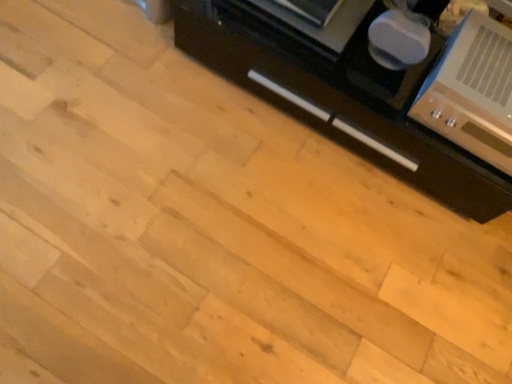
What do you see at coordinates (341, 95) in the screenshot? I see `black matte cabinet at right` at bounding box center [341, 95].

Find the location of a particular element. black matte cabinet at right is located at coordinates (341, 95).

What do you see at coordinates (472, 91) in the screenshot? This screenshot has width=512, height=384. I see `metallic silver stereo at upper right` at bounding box center [472, 91].

Where is `metallic silver stereo at upper right`? This screenshot has width=512, height=384. metallic silver stereo at upper right is located at coordinates (472, 91).

Measure the distance between point (490, 46) and camera.

1.23 meters.

Where is `black matte cabinet at right`? Image resolution: width=512 pixels, height=384 pixels. black matte cabinet at right is located at coordinates (341, 95).

In the scene shown: Is black matte cabinet at right at the right side of metallic silver stereo at upper right?

Incorrect, black matte cabinet at right is not on the right side of metallic silver stereo at upper right.

Considering the positions of objects black matte cabinet at right and metallic silver stereo at upper right in the image provided, who is in front, black matte cabinet at right or metallic silver stereo at upper right?

metallic silver stereo at upper right.

Which point is more forward, (314, 47) or (473, 95)?

Positioned in front is point (473, 95).

From the image's perspective, is black matte cabinet at right located above or below metallic silver stereo at upper right?

black matte cabinet at right is above metallic silver stereo at upper right.

From a real-world perspective, is black matte cabinet at right above or below metallic silver stereo at upper right?

From a real-world perspective, black matte cabinet at right is physically below metallic silver stereo at upper right.

Considering the sizes of black matte cabinet at right and metallic silver stereo at upper right in the image, is black matte cabinet at right wider or thinner than metallic silver stereo at upper right?

Clearly, black matte cabinet at right has more width compared to metallic silver stereo at upper right.

Can you confirm if black matte cabinet at right is taller than metallic silver stereo at upper right?

Indeed, black matte cabinet at right has a greater height compared to metallic silver stereo at upper right.

Which of these two, black matte cabinet at right or metallic silver stereo at upper right, is bigger?

black matte cabinet at right is bigger.

Is metallic silver stereo at upper right completely or partially inside black matte cabinet at right?

No, metallic silver stereo at upper right is not surrounded by black matte cabinet at right.

Is black matte cabinet at right beside metallic silver stereo at upper right?

They are not placed beside each other.

Is black matte cabinet at right oriented towards metallic silver stereo at upper right?

No, black matte cabinet at right is not oriented towards metallic silver stereo at upper right.

Measure the distance from black matte cabinet at right to metallic silver stereo at upper right.

black matte cabinet at right is 8.22 inches away from metallic silver stereo at upper right.

Locate an element on the screen. The width and height of the screenshot is (512, 384). home appliance located on the right of black matte cabinet at right is located at coordinates (472, 91).

Between metallic silver stereo at upper right and black matte cabinet at right, which one appears on the left side from the viewer's perspective?

black matte cabinet at right.

Relative to black matte cabinet at right, is metallic silver stereo at upper right in front or behind?

Clearly, metallic silver stereo at upper right is in front of black matte cabinet at right.

Which is further, (499, 40) or (296, 29)?

The point (296, 29) is farther.

From the image's perspective, is metallic silver stereo at upper right located above black matte cabinet at right?

No, from the image's perspective, metallic silver stereo at upper right is not on top of black matte cabinet at right.

From a real-world perspective, is metallic silver stereo at upper right beneath black matte cabinet at right?

No, from a real-world perspective, metallic silver stereo at upper right is not below black matte cabinet at right.

Between metallic silver stereo at upper right and black matte cabinet at right, which one has smaller width?

metallic silver stereo at upper right is thinner.

Between metallic silver stereo at upper right and black matte cabinet at right, which one has less height?

With less height is metallic silver stereo at upper right.

Considering the relative sizes of metallic silver stereo at upper right and black matte cabinet at right in the image provided, is metallic silver stereo at upper right bigger than black matte cabinet at right?

Incorrect, metallic silver stereo at upper right is not larger than black matte cabinet at right.

Would you say metallic silver stereo at upper right contains black matte cabinet at right?

That's incorrect, black matte cabinet at right is not inside metallic silver stereo at upper right.

Does metallic silver stereo at upper right touch black matte cabinet at right?

metallic silver stereo at upper right is not next to black matte cabinet at right, and they're not touching.

In the scene shown: Is metallic silver stereo at upper right oriented away from black matte cabinet at right?

That's not correct — metallic silver stereo at upper right is not looking away from black matte cabinet at right.

What's the angular difference between metallic silver stereo at upper right and black matte cabinet at right's facing directions?

They differ by 0.000221 degrees in their facing directions.

Looking at this image, how far apart are metallic silver stereo at upper right and black matte cabinet at right?

metallic silver stereo at upper right and black matte cabinet at right are 8.22 inches apart from each other.

The width and height of the screenshot is (512, 384). In order to click on home appliance located on the right of black matte cabinet at right in this screenshot , I will do `click(472, 91)`.

Find the location of a particular element. The image size is (512, 384). home appliance above the black matte cabinet at right (from a real-world perspective) is located at coordinates click(472, 91).

Where is `cabinetry to the left of metallic silver stereo at upper right`? cabinetry to the left of metallic silver stereo at upper right is located at coordinates (341, 95).